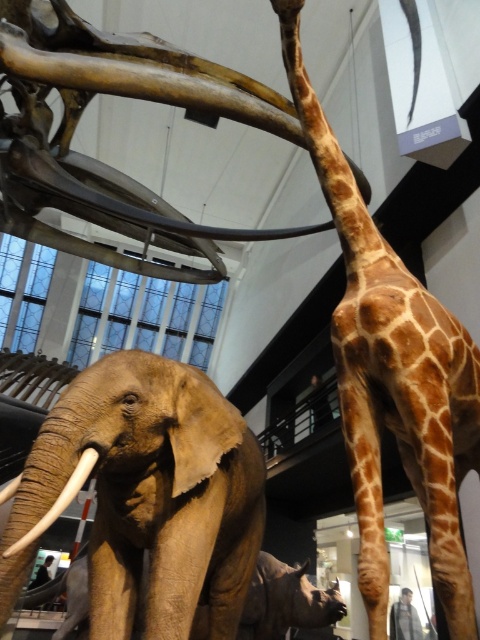
Question: Can you confirm if brown spotted fur at center is bigger than matte brown tusk at lower left?

Choices:
 (A) no
 (B) yes

Answer: (B)

Question: Which object appears closest to the camera in this image?

Choices:
 (A) brown textured elephant at center
 (B) matte brown tusk at lower left

Answer: (B)

Question: Which of the following is the farthest from the observer?

Choices:
 (A) matte brown tusk at lower left
 (B) brown spotted fur at center
 (C) brown textured elephant at center

Answer: (B)

Question: Is brown textured elephant at center behind brown spotted fur at center?

Choices:
 (A) yes
 (B) no

Answer: (B)

Question: Which object appears farthest from the camera in this image?

Choices:
 (A) matte brown tusk at lower left
 (B) brown textured elephant at center
 (C) brown spotted fur at center

Answer: (C)

Question: Observing the image, what is the correct spatial positioning of brown textured elephant at center in reference to matte brown tusk at lower left?

Choices:
 (A) left
 (B) right

Answer: (B)